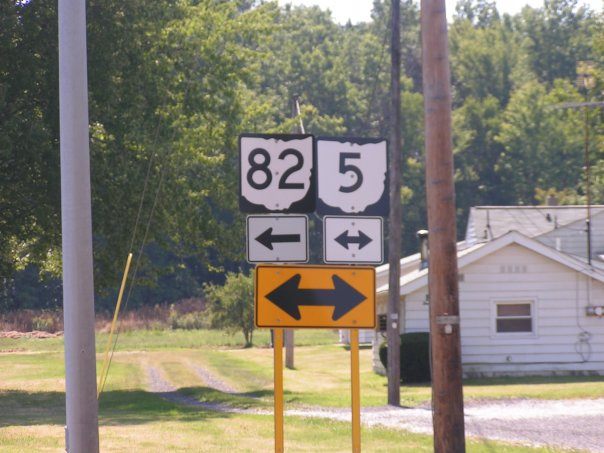
The height and width of the screenshot is (453, 604). Find the location of `window`. window is located at coordinates (528, 313).